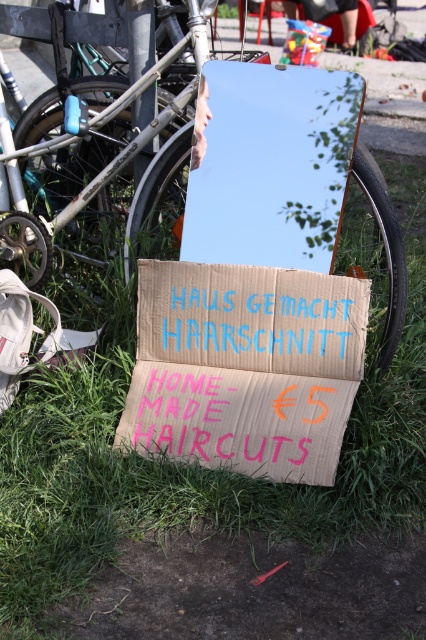
Question: Can you confirm if cardboard sign at center is positioned to the right of metallic reflective mirror at center?

Choices:
 (A) yes
 (B) no

Answer: (B)

Question: Which object appears farthest from the camera in this image?

Choices:
 (A) cardboard sign at center
 (B) silver metallic bicycle at upper left

Answer: (B)

Question: Which object is closer to the camera taking this photo?

Choices:
 (A) cardboard sign at center
 (B) metallic reflective mirror at center

Answer: (A)

Question: In this image, where is silver metallic bicycle at upper left located relative to metallic reflective mirror at center?

Choices:
 (A) above
 (B) below

Answer: (A)

Question: Based on their relative distances, which object is nearer to the silver metallic bicycle at upper left?

Choices:
 (A) cardboard sign at center
 (B) metallic reflective mirror at center

Answer: (B)

Question: Is the position of silver metallic bicycle at upper left more distant than that of metallic reflective mirror at center?

Choices:
 (A) yes
 (B) no

Answer: (B)